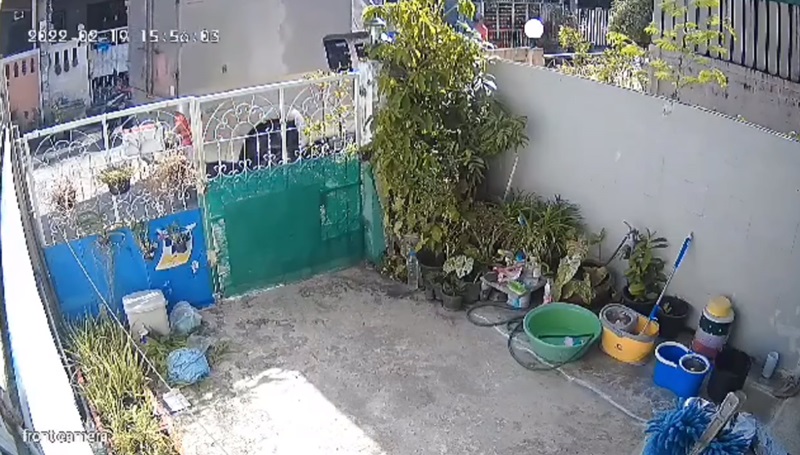
Where is `yellow bucket`? The width and height of the screenshot is (800, 455). yellow bucket is located at coordinates (633, 356).